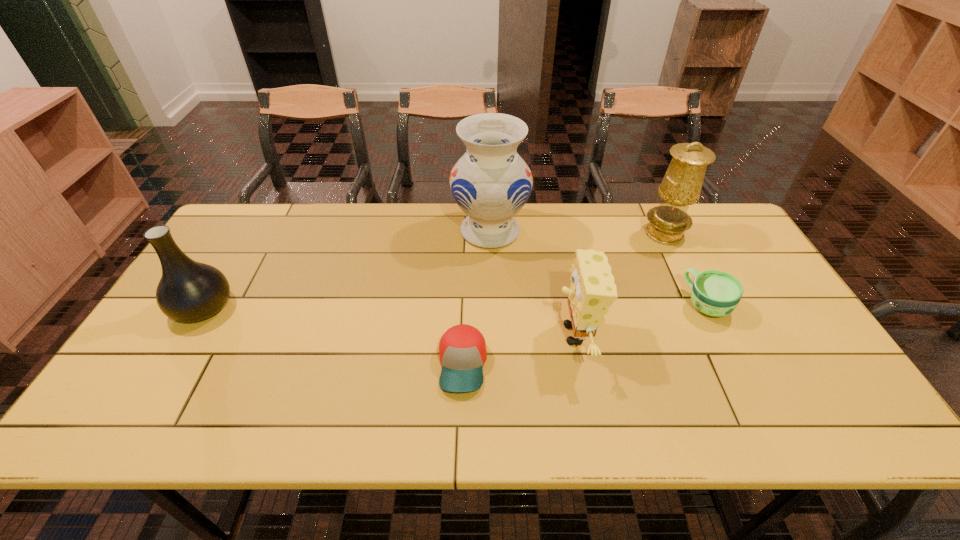
This screenshot has height=540, width=960. In the image, there is a desktop. What are the coordinates of `blank space at the near edge` in the screenshot? It's located at (197, 427).

The height and width of the screenshot is (540, 960). I want to click on free location at the left edge of the desktop, so click(238, 276).

At what (x,y) coordinates should I click in order to perform the action: click on vacant area at the right edge. Please return your answer as a coordinate pair (x, y). Looking at the image, I should click on (786, 335).

Where is `vacant space at the far right corner of the desktop`? This screenshot has height=540, width=960. vacant space at the far right corner of the desktop is located at coordinates (x=732, y=237).

Locate an element on the screen. The image size is (960, 540). free area in between the sponge and the taller vase is located at coordinates [533, 283].

Where is `unoccupied position between the fourth object from left to right and the oil lamp`? unoccupied position between the fourth object from left to right and the oil lamp is located at coordinates (619, 284).

Locate an element on the screen. vacant area that lies between the third object from right to left and the shortest object is located at coordinates (518, 349).

Find the location of a particular element. free space that is in between the right vase and the sponge is located at coordinates (533, 283).

This screenshot has width=960, height=540. In order to click on free space between the cup and the leftmost object in this screenshot , I will do `click(455, 306)`.

The height and width of the screenshot is (540, 960). Find the location of `free space between the nearer vase and the right vase`. free space between the nearer vase and the right vase is located at coordinates pos(347,269).